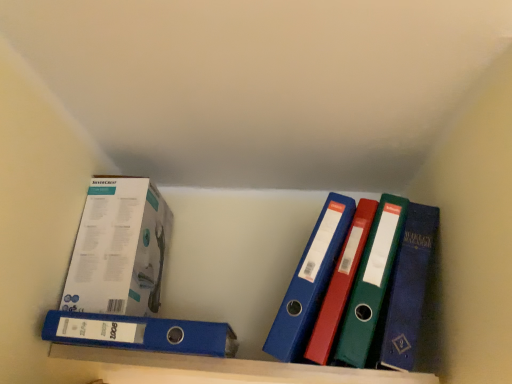
Question: Can you confirm if white cardboard box at upper left is shorter than blue plastic binder at lower left?

Choices:
 (A) yes
 (B) no

Answer: (B)

Question: From the image's perspective, is white cardboard box at upper left beneath blue plastic binder at lower left?

Choices:
 (A) no
 (B) yes

Answer: (A)

Question: Can you confirm if white cardboard box at upper left is smaller than blue plastic binder at lower left?

Choices:
 (A) no
 (B) yes

Answer: (A)

Question: Considering the relative sizes of white cardboard box at upper left and blue plastic binder at lower left in the image provided, is white cardboard box at upper left taller than blue plastic binder at lower left?

Choices:
 (A) yes
 (B) no

Answer: (A)

Question: Is white cardboard box at upper left positioned beyond the bounds of blue plastic binder at lower left?

Choices:
 (A) yes
 (B) no

Answer: (A)

Question: Is blue plastic binder at lower left at the back of white cardboard box at upper left?

Choices:
 (A) no
 (B) yes

Answer: (A)

Question: Considering the relative sizes of blue plastic binder at lower left and white cardboard box at upper left in the image provided, is blue plastic binder at lower left smaller than white cardboard box at upper left?

Choices:
 (A) yes
 (B) no

Answer: (A)

Question: From the image's perspective, is blue plastic binder at lower left below white cardboard box at upper left?

Choices:
 (A) yes
 (B) no

Answer: (A)

Question: Considering the relative sizes of blue plastic binder at lower left and white cardboard box at upper left in the image provided, is blue plastic binder at lower left wider than white cardboard box at upper left?

Choices:
 (A) no
 (B) yes

Answer: (B)

Question: Considering the relative sizes of blue plastic binder at lower left and white cardboard box at upper left in the image provided, is blue plastic binder at lower left taller than white cardboard box at upper left?

Choices:
 (A) no
 (B) yes

Answer: (A)

Question: Considering the relative sizes of blue plastic binder at lower left and white cardboard box at upper left in the image provided, is blue plastic binder at lower left shorter than white cardboard box at upper left?

Choices:
 (A) no
 (B) yes

Answer: (B)

Question: Is blue plastic binder at lower left turned away from white cardboard box at upper left?

Choices:
 (A) no
 (B) yes

Answer: (A)

Question: From a real-world perspective, is blue plastic shelf at lower center on top of white cardboard box at upper left?

Choices:
 (A) no
 (B) yes

Answer: (A)